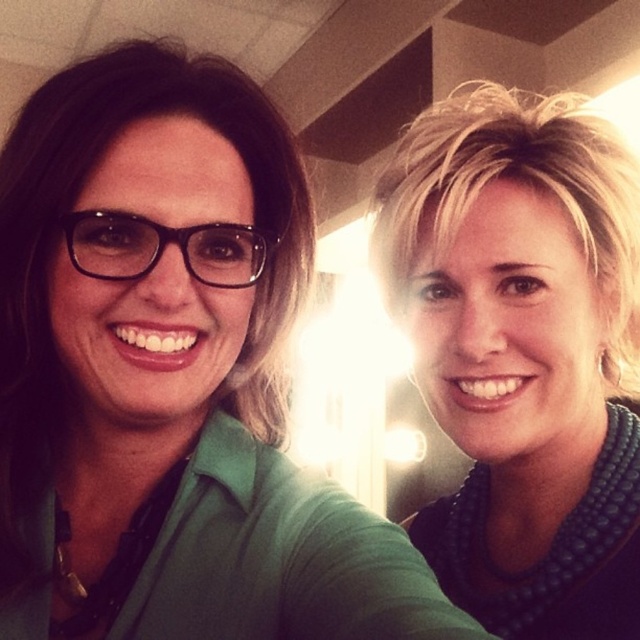
You are a photographer adjusting the camera focus. You need to ensure both the teal beaded necklace at upper right and the black plastic glasses at left are in focus. Which object should you adjust the focus to first considering their sizes?

The teal beaded necklace at upper right has a larger size compared to the black plastic glasses at left, so you should focus on the larger object first to ensure it is sharp before adjusting for the smaller one.

You are a photographer trying to capture a closeup of the teal beaded necklace at upper right and the black plastic glasses at left. Which object should you zoom in on more to ensure both fit in the frame?

The teal beaded necklace at upper right is larger in width than the black plastic glasses at left, so you should zoom in more on the teal beaded necklace at upper right to ensure both fit in the frame.